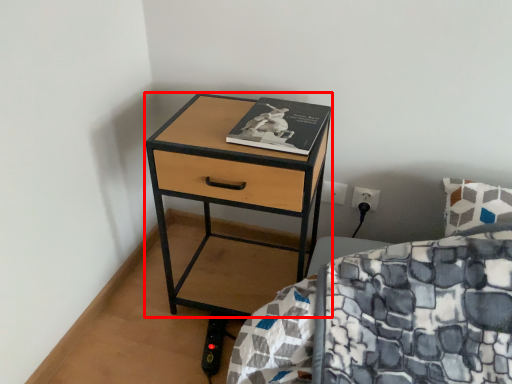
Question: Observing the image, what is the correct spatial positioning of nightstand (annotated by the red box) in reference to book?

Choices:
 (A) left
 (B) right

Answer: (A)